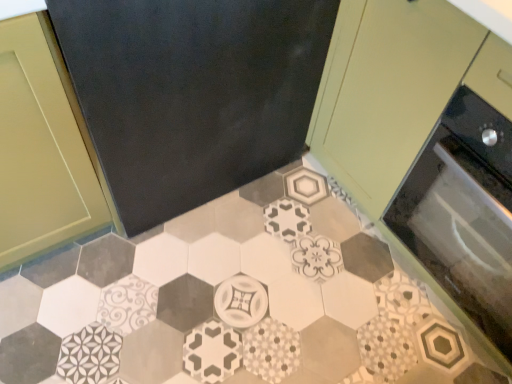
This screenshot has height=384, width=512. What are the coordinates of `black glass oven at right` in the screenshot? It's located at (464, 213).

This screenshot has width=512, height=384. Describe the element at coordinates (214, 303) in the screenshot. I see `patterned ceramic tile at center` at that location.

At what (x,y) coordinates should I click in order to perform the action: click on black glass oven at right. Please return your answer as a coordinate pair (x, y). Looking at the image, I should click on (464, 213).

Between matte green cabinet at upper right and black glass oven at right, which one has smaller size?

With smaller size is black glass oven at right.

Can you see matte green cabinet at upper right touching black glass oven at right?

There is a gap between matte green cabinet at upper right and black glass oven at right.

How different are the orientations of matte green cabinet at upper right and black glass oven at right in degrees?

1.06 degrees separate the facing orientations of matte green cabinet at upper right and black glass oven at right.

Is matte green cabinet at upper right positioned before black glass oven at right?

Yes, matte green cabinet at upper right is in front of black glass oven at right.

Is patterned ceramic tile at center directly adjacent to matte green cabinet at upper right?

No, patterned ceramic tile at center is not touching matte green cabinet at upper right.

The height and width of the screenshot is (384, 512). In order to click on ceramic tile located underneath the matte green cabinet at upper right (from a real-world perspective) in this screenshot , I will do `click(214, 303)`.

From the image's perspective, is patterned ceramic tile at center located above or below matte green cabinet at upper right?

patterned ceramic tile at center is below matte green cabinet at upper right.

From a real-world perspective, between patterned ceramic tile at center and matte green cabinet at upper right, who is vertically higher?

In real-world perspective, matte green cabinet at upper right is above.

Between point (439, 238) and point (347, 39), which one is positioned in front?

Point (347, 39)

Can you confirm if black glass oven at right is wider than matte green cabinet at upper right?

In fact, black glass oven at right might be narrower than matte green cabinet at upper right.

From the picture: Can you tell me how much black glass oven at right and matte green cabinet at upper right differ in facing direction?

1.06 degrees.

From a real-world perspective, is black glass oven at right over matte green cabinet at upper right?

No, from a real-world perspective, black glass oven at right is not on top of matte green cabinet at upper right.

Is patterned ceramic tile at center situated inside black glass oven at right or outside?

The correct answer is: outside.

Is patterned ceramic tile at center not near black glass oven at right?

No, patterned ceramic tile at center is in close proximity to black glass oven at right.

From a real-world perspective, is patterned ceramic tile at center above or below black glass oven at right?

From a real-world perspective, patterned ceramic tile at center is physically below black glass oven at right.

Does patterned ceramic tile at center have a greater width compared to black glass oven at right?

Yes, patterned ceramic tile at center is wider than black glass oven at right.

Where is `cabinetry on the right side of patterned ceramic tile at center`? The image size is (512, 384). cabinetry on the right side of patterned ceramic tile at center is located at coordinates (387, 89).

Is matte green cabinet at upper right shorter than patterned ceramic tile at center?

No, matte green cabinet at upper right is not shorter than patterned ceramic tile at center.

Is patterned ceramic tile at center at the back of matte green cabinet at upper right?

No.

Between matte green cabinet at upper right and patterned ceramic tile at center, which one is positioned behind?

Positioned behind is patterned ceramic tile at center.

From a real-world perspective, relative to patterned ceramic tile at center, is black glass oven at right vertically above or below?

black glass oven at right is situated higher than patterned ceramic tile at center in the real world.

Based on the photo, looking at their sizes, would you say black glass oven at right is wider or thinner than patterned ceramic tile at center?

In the image, black glass oven at right appears to be more narrow than patterned ceramic tile at center.

You are a GUI agent. You are given a task and a screenshot of the screen. Output one action in this format:
    pyautogui.click(x=<x>, y=<y>)
    Task: Click on the oven above the patterned ceramic tile at center (from a real-world perspective)
    
    Given the screenshot: What is the action you would take?
    pyautogui.click(x=464, y=213)

Is black glass oven at right not within patterned ceramic tile at center?

black glass oven at right lies outside patterned ceramic tile at center's area.

Identify the location of cabinetry in front of the black glass oven at right. (387, 89).

Locate an element on the screen. This screenshot has height=384, width=512. ceramic tile below the matte green cabinet at upper right (from a real-world perspective) is located at coordinates (214, 303).

Looking at the image, which one is located further to black glass oven at right, patterned ceramic tile at center or matte green cabinet at upper right?

patterned ceramic tile at center is positioned further to the anchor black glass oven at right.

From the image, which object appears to be nearer to matte green cabinet at upper right, patterned ceramic tile at center or black glass oven at right?

The object closer to matte green cabinet at upper right is black glass oven at right.

When comparing their distances from matte green cabinet at upper right, does black glass oven at right or patterned ceramic tile at center seem closer?

black glass oven at right lies closer to matte green cabinet at upper right than the other object.

Consider the image. Considering their positions, is black glass oven at right positioned closer to patterned ceramic tile at center than matte green cabinet at upper right?

black glass oven at right lies closer to patterned ceramic tile at center than the other object.

Estimate the real-world distances between objects in this image. Which object is closer to patterned ceramic tile at center, matte green cabinet at upper right or black glass oven at right?

Based on the image, black glass oven at right appears to be nearer to patterned ceramic tile at center.

When comparing their distances from black glass oven at right, does matte green cabinet at upper right or patterned ceramic tile at center seem further?

patterned ceramic tile at center lies further to black glass oven at right than the other object.

At what (x,y) coordinates should I click in order to perform the action: click on cabinetry situated between patterned ceramic tile at center and black glass oven at right from left to right. Please return your answer as a coordinate pair (x, y). Image resolution: width=512 pixels, height=384 pixels. Looking at the image, I should click on (387, 89).